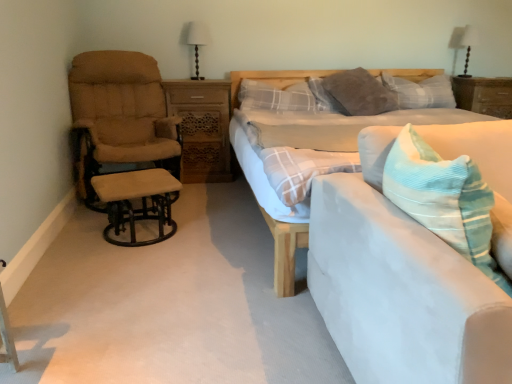
Locate an element on the screen. This screenshot has width=512, height=384. free space that is to the left of beige fabric stool at left is located at coordinates (76, 239).